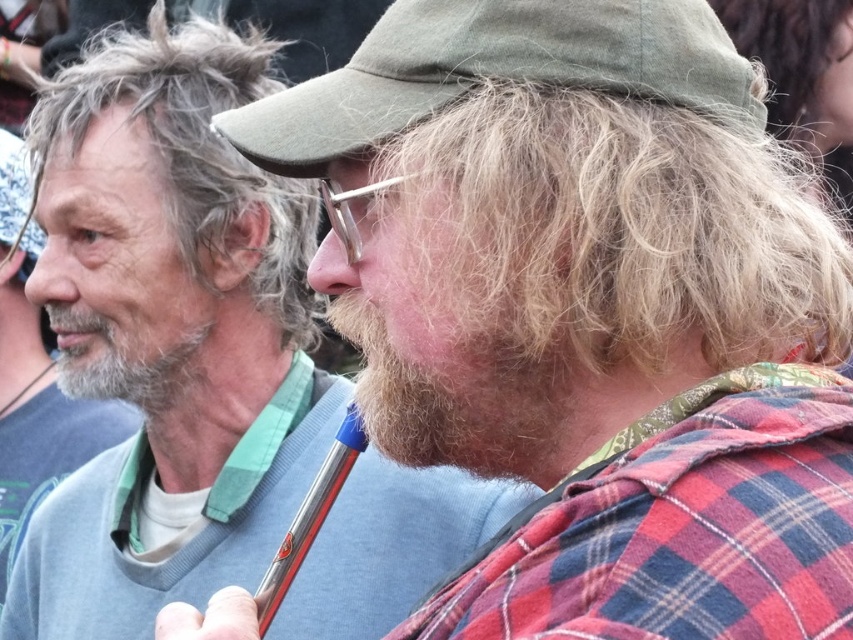
You are a photographer trying to capture a portrait of both the green fabric cap at center and the gray beard at left. Since you want both subjects to be in the frame, which direction should you move your camera to ensure both are fully visible?

The green fabric cap at center is to the right of gray beard at left, so you should move the camera slightly to the left to ensure both subjects are fully visible in the frame.